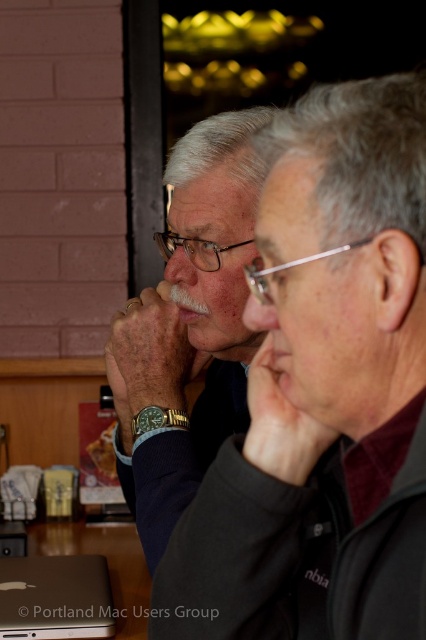
Between silver metallic laptop at lower left and matte skin nose at center, which one has less height?

matte skin nose at center

Between silver metallic laptop at lower left and matte skin nose at center, which one appears on the right side from the viewer's perspective?

matte skin nose at center

Locate an element on the screen. silver metallic laptop at lower left is located at coordinates (54, 596).

Is matte black nose at center taller than matte skin nose at center?

Yes.

Which is more to the right, matte black nose at center or matte skin nose at center?

matte skin nose at center

Who is more forward, (170, 256) or (256, 308)?

Positioned in front is point (256, 308).

Where is `matte black nose at center`? matte black nose at center is located at coordinates (181, 257).

Which is above, matte black jacket at center or silver metallic laptop at lower left?

Positioned higher is matte black jacket at center.

Locate an element on the screen. The width and height of the screenshot is (426, 640). matte black jacket at center is located at coordinates (187, 332).